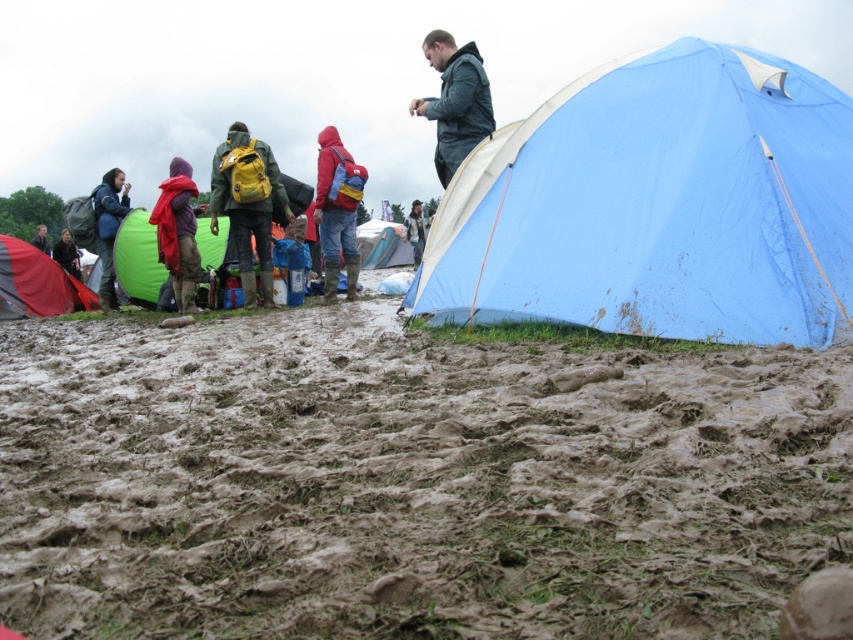
Which is above, blue fabric tent at upper right or denim jacket at center?

Positioned higher is denim jacket at center.

Is point (558, 244) farther from viewer compared to point (415, 205)?

No.

Where is `blue fabric tent at upper right`? The width and height of the screenshot is (853, 640). blue fabric tent at upper right is located at coordinates (659, 205).

The height and width of the screenshot is (640, 853). I want to click on blue fabric tent at upper right, so click(659, 205).

Is point (412, 246) closer to viewer compared to point (45, 252)?

That is False.

What do you see at coordinates (415, 230) in the screenshot?
I see `denim jacket at center` at bounding box center [415, 230].

Image resolution: width=853 pixels, height=640 pixels. Describe the element at coordinates (415, 230) in the screenshot. I see `denim jacket at center` at that location.

At what (x,y) coordinates should I click in order to perform the action: click on denim jacket at center. Please return your answer as a coordinate pair (x, y). Image resolution: width=853 pixels, height=640 pixels. Looking at the image, I should click on (415, 230).

Who is positioned more to the left, brown muddy ground at lower center or red woolen scarf at left?

Positioned to the left is red woolen scarf at left.

Does point (77, 445) come farther from viewer compared to point (183, 218)?

No, it is not.

Where is `brown muddy ground at lower center`? brown muddy ground at lower center is located at coordinates (408, 481).